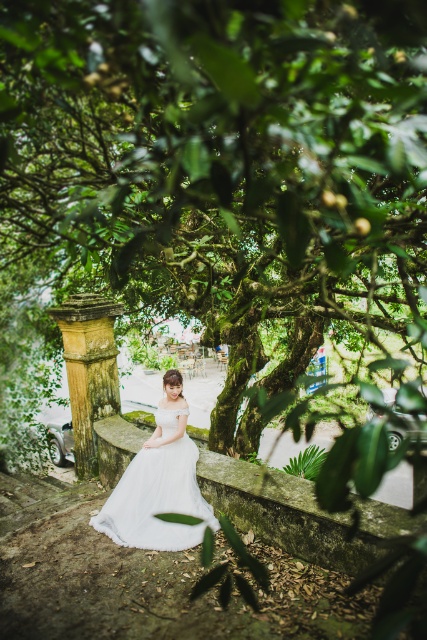
You are a photographer planning to capture the bride in the scene. The bride is currently seated at the center on the stone ledge under the tree. You need to position a small bouquet of white roses exactly at point [149,488]. According to the scene description, what object is already present at that location?

At point [149,488] lies the white tulle dress at center, so the white tulle dress at center is already present there.

You are a photographer standing in front of the green mossy tree at center, aiming to capture the bride sitting on the stone ledge beneath it. Considering the tree is 3.55 meters away from you, will you need to adjust your camera focus to ensure the tree and the bride are both in sharp focus?

The green mossy tree at center is 3.55 meters away from the viewer. Since the bride is sitting directly beneath it on the stone ledge, the distance between them is minimal. Adjusting the camera focus to a midrange setting should keep both the tree and the bride in focus without needing extreme adjustments.

You are a photographer planning to capture the bride in the white tulle dress at center and the green mossy tree at center. Based on their heights, which one will require you to adjust your camera angle more to fully capture in the photo?

The white tulle dress at center is taller than the green mossy tree at center, so you will need to adjust your camera angle more to fully capture the white tulle dress at center in the photo.